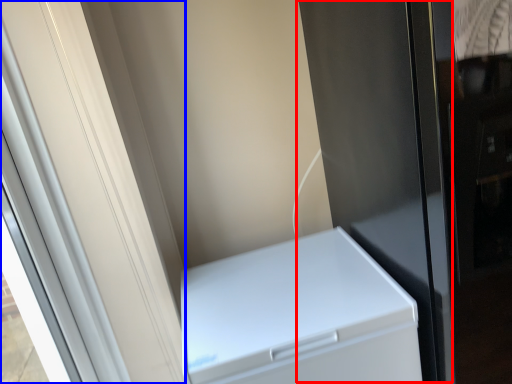
Question: Which object is closer to the camera taking this photo, screen door (highlighted by a red box) or screen door (highlighted by a blue box)?

Choices:
 (A) screen door
 (B) screen door

Answer: (B)